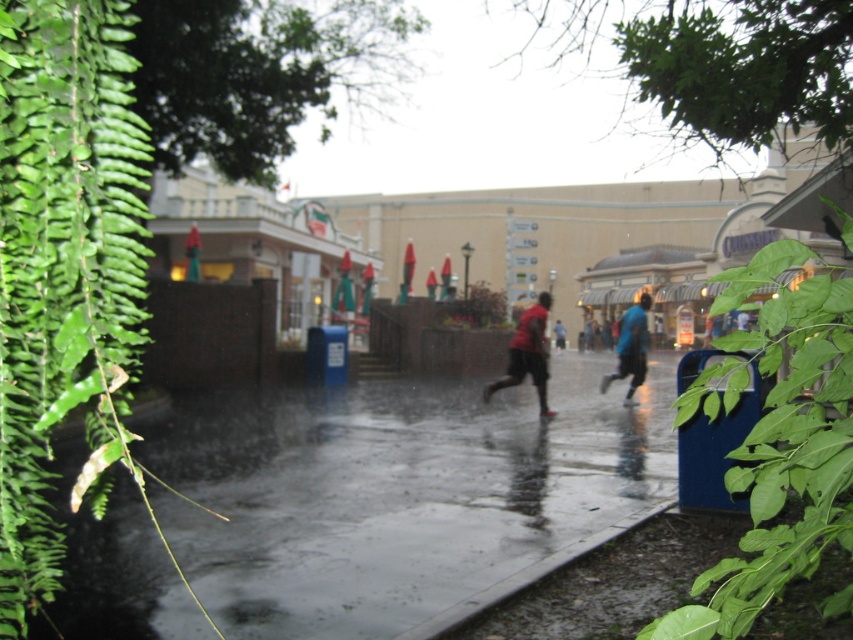
Is glossy concrete pavement at center below red matte shirt at center?

Correct, glossy concrete pavement at center is located below red matte shirt at center.

In order to click on glossy concrete pavement at center in this screenshot , I will do `click(399, 492)`.

This screenshot has height=640, width=853. In order to click on glossy concrete pavement at center in this screenshot , I will do (399, 492).

Is green leafy fern at lower right in front of red matte shirt at center?

Yes, it is.

Who is shorter, green leafy fern at lower right or red matte shirt at center?

red matte shirt at center

Image resolution: width=853 pixels, height=640 pixels. I want to click on green leafy fern at lower right, so click(x=784, y=458).

Between green leafy fern at left and green leafy fern at lower right, which one has less height?

green leafy fern at left is shorter.

Can you confirm if green leafy fern at left is bigger than green leafy fern at lower right?

Incorrect, green leafy fern at left is not larger than green leafy fern at lower right.

Which is in front, point (113, 172) or point (712, 372)?

Point (113, 172) is in front.

Find the location of a particular element. green leafy fern at left is located at coordinates (65, 272).